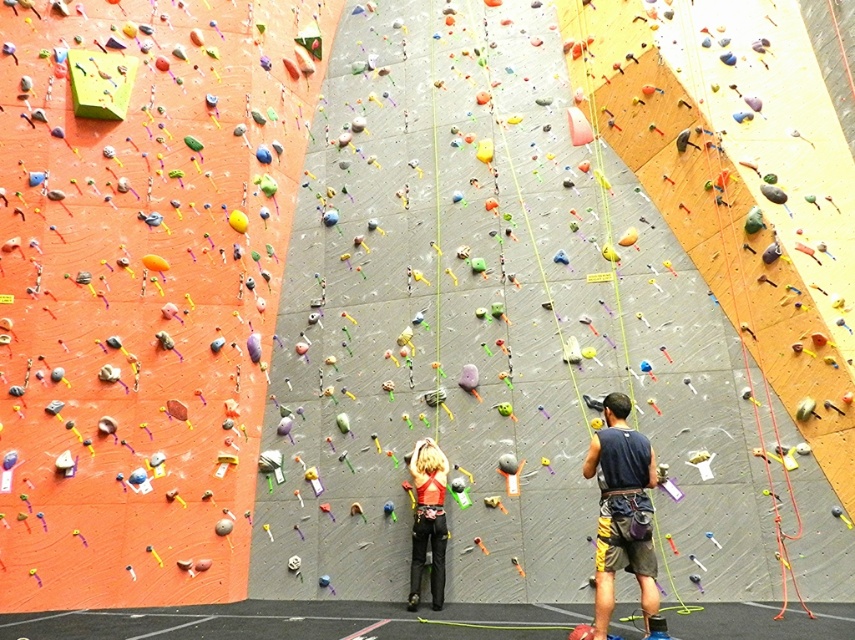
Question: Is dark blue tank top at center closer to the viewer compared to matte red harness at center?

Choices:
 (A) yes
 (B) no

Answer: (A)

Question: Which point appears closest to the camera in this image?

Choices:
 (A) (423, 512)
 (B) (610, 444)

Answer: (B)

Question: Among these objects, which one is nearest to the camera?

Choices:
 (A) dark blue tank top at center
 (B) matte red harness at center

Answer: (A)

Question: Among these points, which one is farthest from the camera?

Choices:
 (A) (603, 509)
 (B) (431, 488)

Answer: (B)

Question: Is dark blue tank top at center wider than matte red harness at center?

Choices:
 (A) no
 (B) yes

Answer: (B)

Question: Can you confirm if dark blue tank top at center is thinner than matte red harness at center?

Choices:
 (A) yes
 (B) no

Answer: (B)